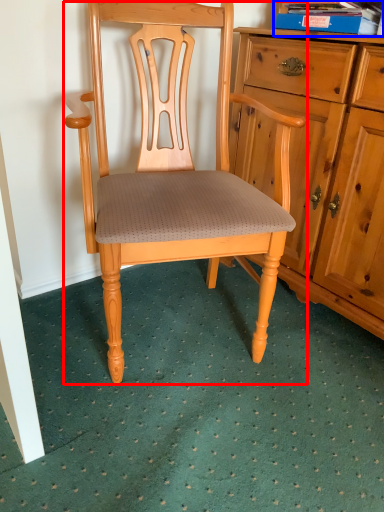
Question: Which point is closer to the camera, chair (highlighted by a red box) or book (highlighted by a blue box)?

Choices:
 (A) chair
 (B) book

Answer: (A)